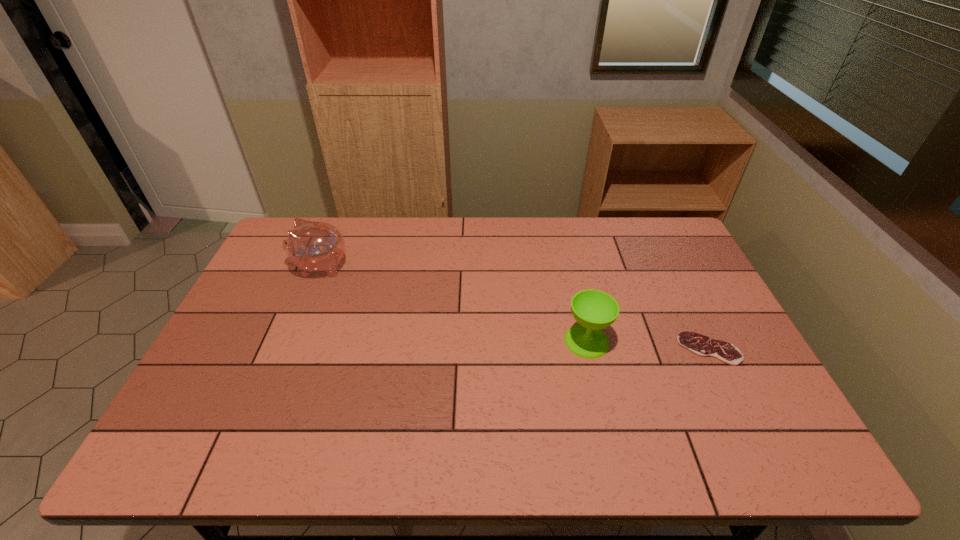
The width and height of the screenshot is (960, 540). I want to click on blank area in the image that satisfies the following two spatial constraints: 1. on the front facing side of the tallest object; 2. on the left side of the shortest object, so click(286, 349).

Image resolution: width=960 pixels, height=540 pixels. I want to click on free space that satisfies the following two spatial constraints: 1. on the front facing side of the rightmost object; 2. on the left side of the tallest object, so click(x=286, y=349).

Identify the location of vacant point that satisfies the following two spatial constraints: 1. on the front facing side of the farthest object; 2. on the left side of the rightmost object. (286, 349).

Where is `free region that satisfies the following two spatial constraints: 1. on the front facing side of the wineglass; 2. on the left side of the farthest object`? This screenshot has width=960, height=540. free region that satisfies the following two spatial constraints: 1. on the front facing side of the wineglass; 2. on the left side of the farthest object is located at coordinates (289, 341).

Where is `free space that satisfies the following two spatial constraints: 1. on the front facing side of the piggy bank; 2. on the back side of the shortest object`? free space that satisfies the following two spatial constraints: 1. on the front facing side of the piggy bank; 2. on the back side of the shortest object is located at coordinates (286, 349).

Identify the location of free space that satisfies the following two spatial constraints: 1. on the front facing side of the rightmost object; 2. on the right side of the leftmost object. The image size is (960, 540). (286, 349).

Where is `vacant space that satisfies the following two spatial constraints: 1. on the front facing side of the wineglass; 2. on the left side of the farthest object`? This screenshot has height=540, width=960. vacant space that satisfies the following two spatial constraints: 1. on the front facing side of the wineglass; 2. on the left side of the farthest object is located at coordinates (289, 341).

I want to click on vacant space that satisfies the following two spatial constraints: 1. on the front facing side of the second tallest object; 2. on the left side of the piggy bank, so click(289, 341).

You are a GUI agent. You are given a task and a screenshot of the screen. Output one action in this format:
    pyautogui.click(x=<x>, y=<y>)
    Task: Click on the free space that satisfies the following two spatial constraints: 1. on the back side of the rightmost object; 2. on the front facing side of the leftmost object
    
    Given the screenshot: What is the action you would take?
    pyautogui.click(x=668, y=266)

Where is `free location that satisfies the following two spatial constraints: 1. on the front facing side of the leftmost object; 2. on the back side of the second object from right to left`? The image size is (960, 540). free location that satisfies the following two spatial constraints: 1. on the front facing side of the leftmost object; 2. on the back side of the second object from right to left is located at coordinates (289, 341).